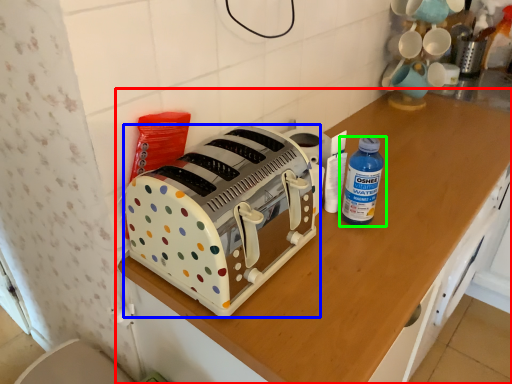
Question: Based on their relative distances, which object is nearer to cabinetry (highlighted by a red box)? Choose from toaster (highlighted by a blue box) and bottle (highlighted by a green box).

Choices:
 (A) toaster
 (B) bottle

Answer: (A)